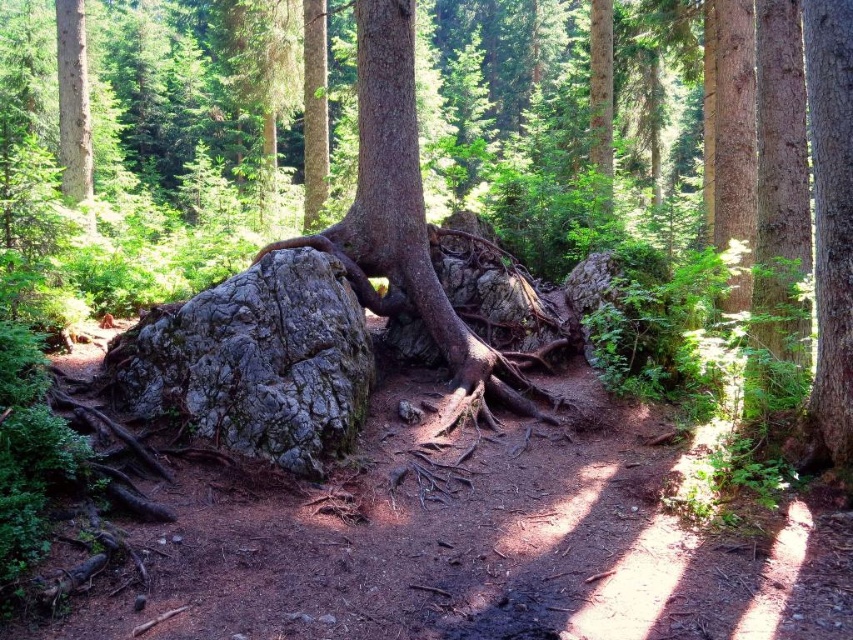
You are a hiker trying to navigate through the forest. You see the gray rough rock at center and the gray rough boulder at center. Which one is positioned to the right side from your perspective?

The gray rough rock at center is to the right of the gray rough boulder at center, so the gray rough rock at center is positioned to the right side.

You are a hiker who wants to climb the gray rough rock at center and the gray rough boulder at center. Based on their sizes, which one do you think is easier to climb?

The gray rough boulder at center is shorter than the gray rough rock at center, so it might be easier to climb.

You are a hiker who wants to place a small backpack on the gray rough rock at center and gray rough boulder at center. Which one can you place it on without it falling off?

The gray rough rock at center is positioned over gray rough boulder at center, so placing the backpack on the gray rough rock at center may cause it to fall off. The gray rough boulder at center is a more stable option.